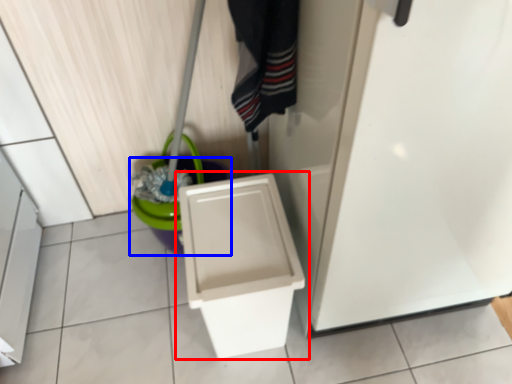
Question: Which of the following is the farthest to the observer, toilet (highlighted by a red box) or potty (highlighted by a blue box)?

Choices:
 (A) toilet
 (B) potty

Answer: (B)